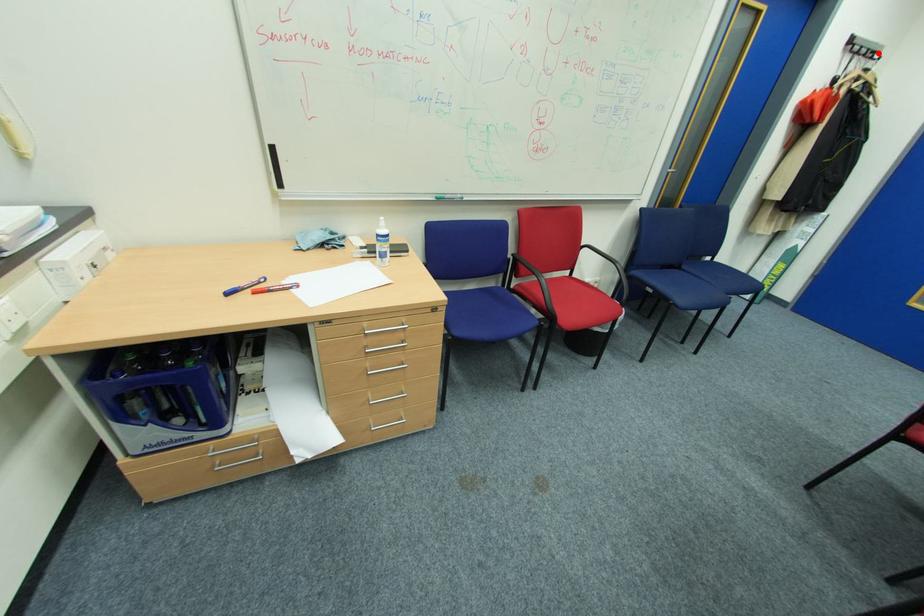
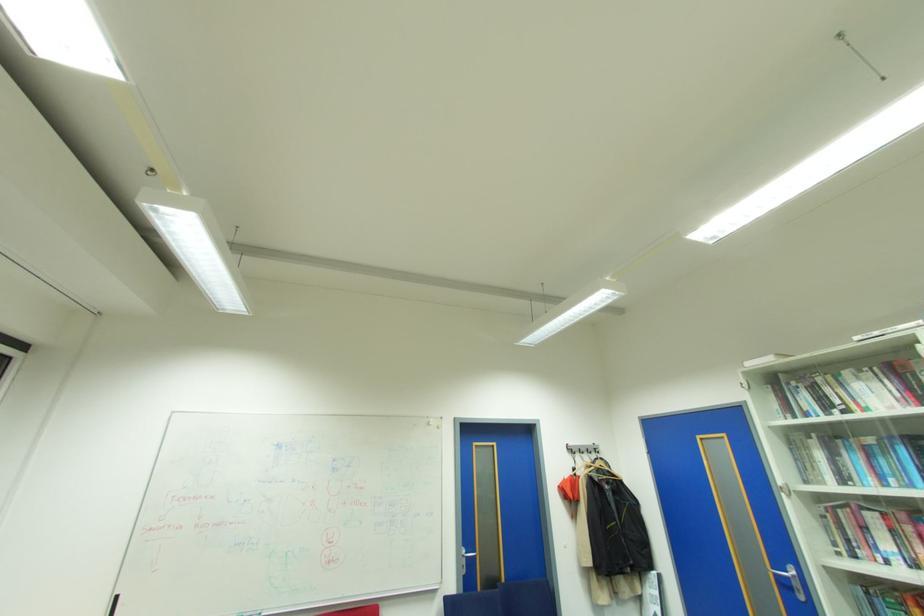
Question: I am providing you with two images of the same scene from different viewpoints. In image1, a red point is highlighted. Considering the same 3D point in image2, which of the following is correct?

Choices:
 (A) It is closer
 (B) It is farther

Answer: (A)